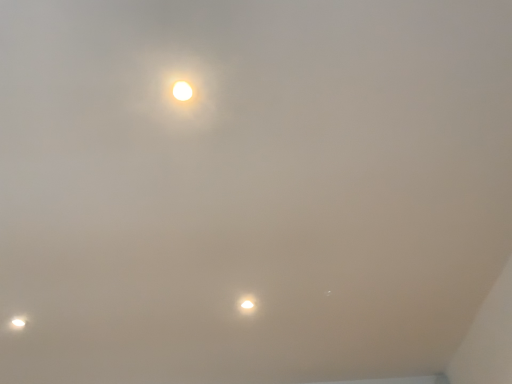
Describe the element at coordinates (18, 322) in the screenshot. I see `matte white lamp at lower left, which ranks as the second lamp in front-to-back order` at that location.

Locate an element on the screen. This screenshot has width=512, height=384. matte white lamp at lower left, which is the 1th lamp in bottom-to-top order is located at coordinates (18, 322).

Measure the distance between matte white lamp at lower left, which appears as the first lamp when viewed from the left, and camera.

They are 1.74 meters apart.

What is the approximate height of matte white lamp at center, which is counted as the first lamp, starting from the front?

matte white lamp at center, which is counted as the first lamp, starting from the front, is 0.79 inches in height.

Image resolution: width=512 pixels, height=384 pixels. What do you see at coordinates (247, 304) in the screenshot?
I see `matte white lamp at center, which appears as the first lamp when viewed from the right` at bounding box center [247, 304].

Find the location of `matte white lamp at center, the 2th lamp in the back-to-front sequence`. matte white lamp at center, the 2th lamp in the back-to-front sequence is located at coordinates (247, 304).

Identify the location of matte white lamp at lower left, arranged as the second lamp when viewed from the top. This screenshot has height=384, width=512. (18, 322).

Does matte white lamp at center, which is counted as the first lamp, starting from the front, appear on the right side of matte white lamp at lower left, which ranks as the second lamp in front-to-back order?

Yes, matte white lamp at center, which is counted as the first lamp, starting from the front, is to the right of matte white lamp at lower left, which ranks as the second lamp in front-to-back order.

Is matte white lamp at center, which is counted as the first lamp, starting from the front, positioned before matte white lamp at lower left, arranged as the second lamp when viewed from the top?

Yes, matte white lamp at center, which is counted as the first lamp, starting from the front, is closer to the viewer.

Which is less distant, (247, 302) or (19, 327)?

The point (247, 302) is closer.

From the image's perspective, which is below, matte white lamp at center, acting as the second lamp starting from the bottom, or matte white lamp at lower left, which appears as the first lamp when viewed from the left?

From the image's view, matte white lamp at lower left, which appears as the first lamp when viewed from the left, is below.

From a real-world perspective, is matte white lamp at center, acting as the second lamp starting from the bottom, positioned under matte white lamp at lower left, which ranks as the second lamp in front-to-back order, based on gravity?

Incorrect, from a real-world perspective, matte white lamp at center, acting as the second lamp starting from the bottom, is higher than matte white lamp at lower left, which ranks as the second lamp in front-to-back order.

Between matte white lamp at center, arranged as the second lamp when viewed from the left, and matte white lamp at lower left, which is the 1th lamp in bottom-to-top order, which one has larger width?

Wider between the two is matte white lamp at lower left, which is the 1th lamp in bottom-to-top order.

Can you confirm if matte white lamp at center, the 2th lamp in the back-to-front sequence, is shorter than matte white lamp at lower left, which appears as the first lamp when viewed from the left?

In fact, matte white lamp at center, the 2th lamp in the back-to-front sequence, may be taller than matte white lamp at lower left, which appears as the first lamp when viewed from the left.

Which of these two, matte white lamp at center, acting as the second lamp starting from the bottom, or matte white lamp at lower left, arranged as the first lamp when viewed from the back, is smaller?

Smaller between the two is matte white lamp at lower left, arranged as the first lamp when viewed from the back.

Does matte white lamp at center, which appears as the first lamp when viewed from the right, contain matte white lamp at lower left, arranged as the second lamp when viewed from the top?

No, matte white lamp at lower left, arranged as the second lamp when viewed from the top, is located outside of matte white lamp at center, which appears as the first lamp when viewed from the right.

Would you consider matte white lamp at center, arranged as the 1th lamp when viewed from the top, to be distant from matte white lamp at lower left, which appears as the first lamp when viewed from the left?

That's not correct — matte white lamp at center, arranged as the 1th lamp when viewed from the top, is a little close to matte white lamp at lower left, which appears as the first lamp when viewed from the left.

Is matte white lamp at center, the 2th lamp in the back-to-front sequence, oriented away from matte white lamp at lower left, which is the 1th lamp in bottom-to-top order?

No, matte white lamp at center, the 2th lamp in the back-to-front sequence, is not facing away from matte white lamp at lower left, which is the 1th lamp in bottom-to-top order.

How many degrees apart are the facing directions of matte white lamp at center, the 2th lamp in the back-to-front sequence, and matte white lamp at lower left, arranged as the second lamp when viewed from the top?

174 degrees.

In the image, there is a matte white lamp at lower left, arranged as the second lamp when viewed from the top. Where is `lamp above it (from the image's perspective)`? This screenshot has width=512, height=384. lamp above it (from the image's perspective) is located at coordinates (247, 304).

Is matte white lamp at lower left, arranged as the first lamp when viewed from the back, to the left or to the right of matte white lamp at center, acting as the second lamp starting from the bottom, in the image?

Clearly, matte white lamp at lower left, arranged as the first lamp when viewed from the back, is on the left of matte white lamp at center, acting as the second lamp starting from the bottom, in the image.

From the picture: Is matte white lamp at lower left, which appears as the first lamp when viewed from the left, in front of matte white lamp at center, which is counted as the first lamp, starting from the front?

No, it is behind matte white lamp at center, which is counted as the first lamp, starting from the front.

Is point (12, 320) closer or farther from the camera than point (246, 303)?

Point (12, 320) is farther from the camera than point (246, 303).

Looking at this image, from the image's perspective, between matte white lamp at lower left, which appears as the first lamp when viewed from the left, and matte white lamp at center, the 2th lamp in the back-to-front sequence, who is located below?

matte white lamp at lower left, which appears as the first lamp when viewed from the left, from the image's perspective.

From a real-world perspective, is matte white lamp at lower left, which is the 1th lamp in bottom-to-top order, physically below matte white lamp at center, the 2th lamp in the back-to-front sequence?

Correct, in the physical world, matte white lamp at lower left, which is the 1th lamp in bottom-to-top order, is lower than matte white lamp at center, the 2th lamp in the back-to-front sequence.

Does matte white lamp at lower left, which appears as the first lamp when viewed from the left, have a lesser width compared to matte white lamp at center, the 2th lamp in the back-to-front sequence?

In fact, matte white lamp at lower left, which appears as the first lamp when viewed from the left, might be wider than matte white lamp at center, the 2th lamp in the back-to-front sequence.

In terms of height, does matte white lamp at lower left, arranged as the first lamp when viewed from the back, look taller or shorter compared to matte white lamp at center, the 2th lamp in the back-to-front sequence?

In the image, matte white lamp at lower left, arranged as the first lamp when viewed from the back, appears to be shorter than matte white lamp at center, the 2th lamp in the back-to-front sequence.

Considering the sizes of matte white lamp at lower left, which ranks as the second lamp in front-to-back order, and matte white lamp at center, which appears as the first lamp when viewed from the right, in the image, is matte white lamp at lower left, which ranks as the second lamp in front-to-back order, bigger or smaller than matte white lamp at center, which appears as the first lamp when viewed from the right,?

In the image, matte white lamp at lower left, which ranks as the second lamp in front-to-back order, appears to be smaller than matte white lamp at center, which appears as the first lamp when viewed from the right.

Can we say matte white lamp at lower left, the 2th lamp when ordered from right to left, lies outside matte white lamp at center, the 2th lamp in the back-to-front sequence?

matte white lamp at lower left, the 2th lamp when ordered from right to left, lies outside matte white lamp at center, the 2th lamp in the back-to-front sequence,'s area.

Is matte white lamp at lower left, which is the 1th lamp in bottom-to-top order, far away from matte white lamp at center, arranged as the second lamp when viewed from the left?

That's not correct — matte white lamp at lower left, which is the 1th lamp in bottom-to-top order, is a little close to matte white lamp at center, arranged as the second lamp when viewed from the left.

Based on the photo, could you tell me if matte white lamp at lower left, the 2th lamp when ordered from right to left, is turned towards matte white lamp at center, which appears as the first lamp when viewed from the right?

Yes, matte white lamp at lower left, the 2th lamp when ordered from right to left, is turned towards matte white lamp at center, which appears as the first lamp when viewed from the right.

How many degrees apart are the facing directions of matte white lamp at lower left, which is the 1th lamp in bottom-to-top order, and matte white lamp at center, which appears as the first lamp when viewed from the right?

The angular difference between matte white lamp at lower left, which is the 1th lamp in bottom-to-top order, and matte white lamp at center, which appears as the first lamp when viewed from the right, is 174 degrees.

Could you measure the distance between matte white lamp at lower left, the 2th lamp when ordered from right to left, and matte white lamp at center, arranged as the 1th lamp when viewed from the top?

matte white lamp at lower left, the 2th lamp when ordered from right to left, and matte white lamp at center, arranged as the 1th lamp when viewed from the top, are 93.22 centimeters apart from each other.

Locate an element on the screen. lamp that is on the right side of matte white lamp at lower left, the 2th lamp when ordered from right to left is located at coordinates (247, 304).

Locate an element on the screen. This screenshot has width=512, height=384. lamp that appears above the matte white lamp at lower left, arranged as the second lamp when viewed from the top (from a real-world perspective) is located at coordinates (247, 304).

At what (x,y) coordinates should I click in order to perform the action: click on lamp that appears behind the matte white lamp at center, the 2th lamp in the back-to-front sequence. Please return your answer as a coordinate pair (x, y). The height and width of the screenshot is (384, 512). Looking at the image, I should click on (18, 322).